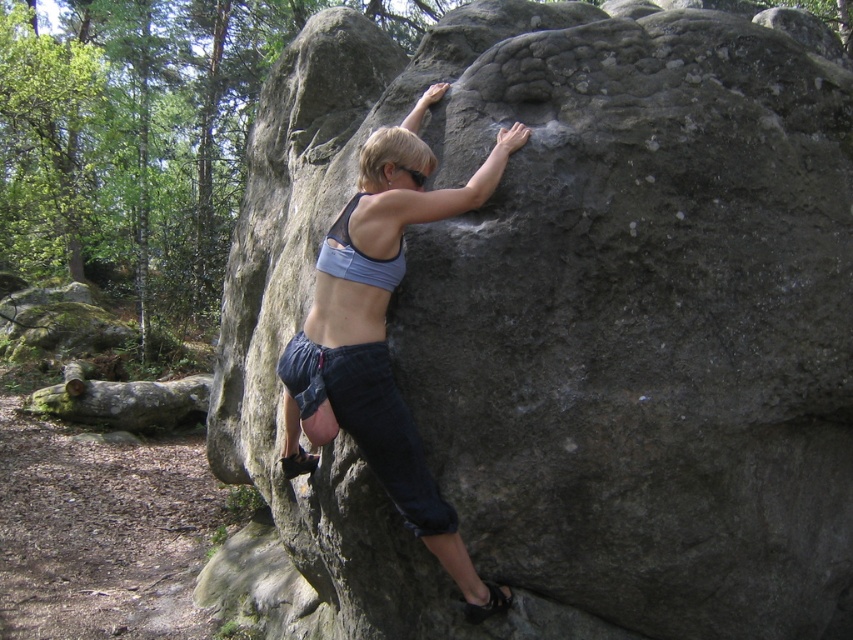
Question: Is matte gray rock climber at center positioned at the back of blue fabric bikini top at center?

Choices:
 (A) no
 (B) yes

Answer: (A)

Question: In this image, where is matte gray rock climber at center located relative to blue fabric bikini top at center?

Choices:
 (A) above
 (B) below

Answer: (B)

Question: Which object is closer to the camera taking this photo?

Choices:
 (A) blue fabric bikini top at center
 (B) matte gray rock climber at center

Answer: (B)

Question: Which object appears closest to the camera in this image?

Choices:
 (A) matte gray rock climber at center
 (B) blue fabric bikini top at center

Answer: (A)

Question: Is matte gray rock climber at center above blue fabric bikini top at center?

Choices:
 (A) no
 (B) yes

Answer: (A)